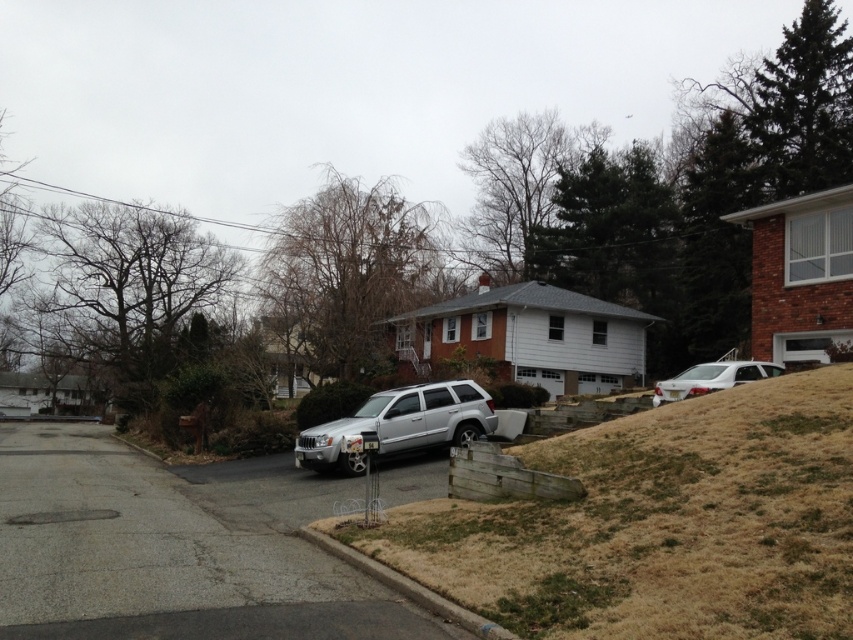
You are standing on the brown concrete curb at lower center and want to reach the brown grass at lower right. Which direction should you move to get there?

The brown grass at lower right is above the brown concrete curb at lower center, so you should move upward to reach it.

You are standing at the starting point of the stairs leading to the front door of the house. You want to walk to the brown grass at lower right. Which direction should you go relative to your current position?

The brown grass at lower right is located at coordinates 0.820 on the x axis and 0.775 on the y axis. Since you are at the base of the stairs leading to the front door, you should head towards the lower right direction to reach the brown grass at lower right.